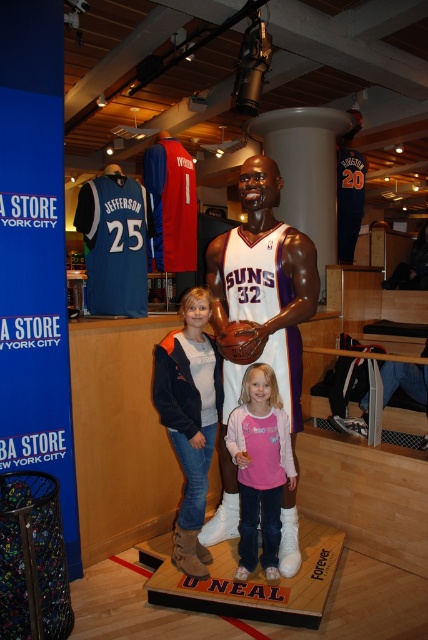
From the picture: Between denim jacket at center and pink fabric shirt at center, which one has more height?

denim jacket at center is taller.

Does denim jacket at center have a larger size compared to pink fabric shirt at center?

Yes.

Identify the location of denim jacket at center. The image size is (428, 640). (190, 419).

Can you confirm if white glossy basketball player at center is positioned below denim jacket at center?

Actually, white glossy basketball player at center is above denim jacket at center.

Does point (299, 401) lie behind point (216, 435)?

No, it is in front of (216, 435).

Is point (213, 243) more distant than point (169, 406)?

That is True.

Where is `white glossy basketball player at center`? This screenshot has height=640, width=428. white glossy basketball player at center is located at coordinates (258, 310).

What do you see at coordinates (258, 310) in the screenshot?
I see `white glossy basketball player at center` at bounding box center [258, 310].

Who is positioned more to the right, white glossy basketball player at center or pink fabric shirt at center?

Positioned to the right is pink fabric shirt at center.

The width and height of the screenshot is (428, 640). Find the location of `white glossy basketball player at center`. white glossy basketball player at center is located at coordinates (258, 310).

Where is `white glossy basketball player at center`? white glossy basketball player at center is located at coordinates click(258, 310).